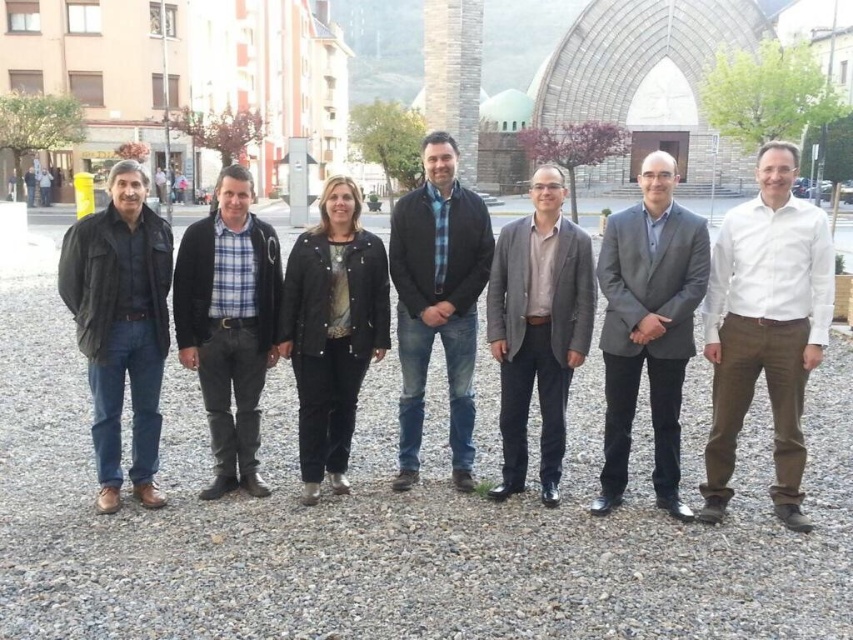
You are a photographer trying to adjust the focus on your camera. You notice two items at the center of the image, the blue plaid shirt at center and the black leather jacket at center. Which item should you focus on if you want to capture the taller object?

The blue plaid shirt at center is much taller than the black leather jacket at center, so you should focus on the blue plaid shirt at center to capture the taller object.

You are a photographer trying to adjust the group photo setup. You notice the blue plaid shirt at center and the black leather jacket at center. Which clothing item is wider?

The blue plaid shirt at center is wider than the black leather jacket at center according to the description.

Where is the gray suit at center located in the image?

The gray suit at center is located at point coordinates of (648, 326).